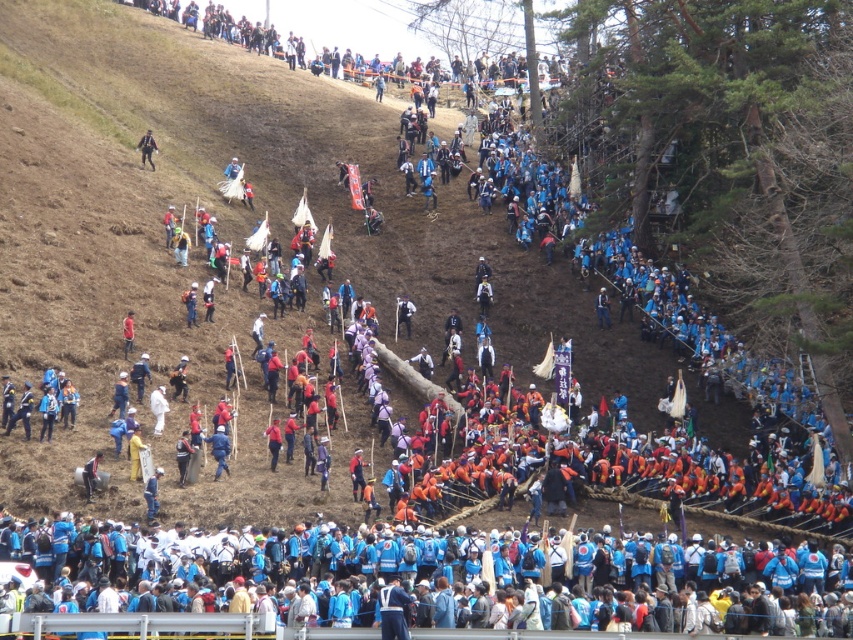
Is red fabric flag at center taller than matte black backpack at upper left?

Correct, red fabric flag at center is much taller as matte black backpack at upper left.

Is red fabric flag at center further to the viewer compared to matte black backpack at upper left?

No, red fabric flag at center is closer to the viewer.

Locate an element on the screen. red fabric flag at center is located at coordinates (273, 442).

Which is above, blue fabric jacket at center or red fabric flag at center?

blue fabric jacket at center

The image size is (853, 640). Find the location of `blue fabric jacket at center`. blue fabric jacket at center is located at coordinates (219, 449).

Is blue fabric jacket at center positioned before matte black backpack at upper left?

Yes, blue fabric jacket at center is in front of matte black backpack at upper left.

What do you see at coordinates (219, 449) in the screenshot? The image size is (853, 640). I see `blue fabric jacket at center` at bounding box center [219, 449].

Where is `blue fabric jacket at center`? Image resolution: width=853 pixels, height=640 pixels. blue fabric jacket at center is located at coordinates (219, 449).